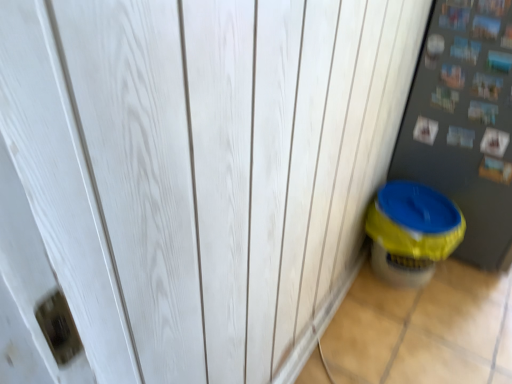
This screenshot has width=512, height=384. Describe the element at coordinates (411, 232) in the screenshot. I see `yellow plastic potty at lower right` at that location.

Locate an element on the screen. This screenshot has height=384, width=512. yellow plastic potty at lower right is located at coordinates (411, 232).

Where is `yellow plastic potty at lower right`? The height and width of the screenshot is (384, 512). yellow plastic potty at lower right is located at coordinates (411, 232).